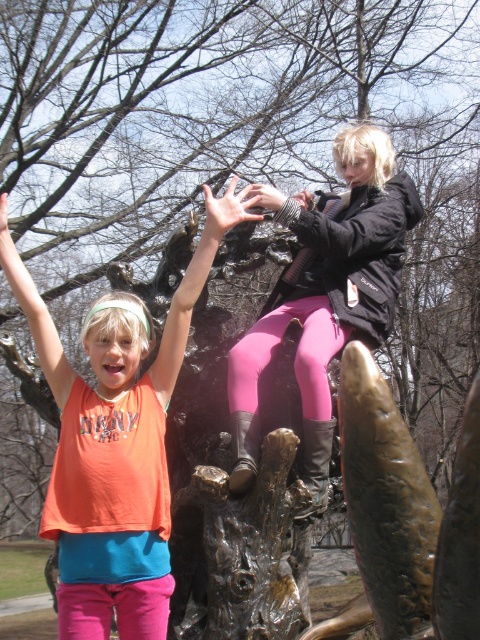
Is point (389, 275) positioned in front of point (168, 602)?

No, (389, 275) is behind (168, 602).

Is pink matte leggings at upper center to the left of orange fabric shirt at upper left from the viewer's perspective?

In fact, pink matte leggings at upper center is to the right of orange fabric shirt at upper left.

This screenshot has height=640, width=480. What do you see at coordinates (326, 296) in the screenshot?
I see `pink matte leggings at upper center` at bounding box center [326, 296].

Image resolution: width=480 pixels, height=640 pixels. I want to click on pink matte leggings at upper center, so click(x=326, y=296).